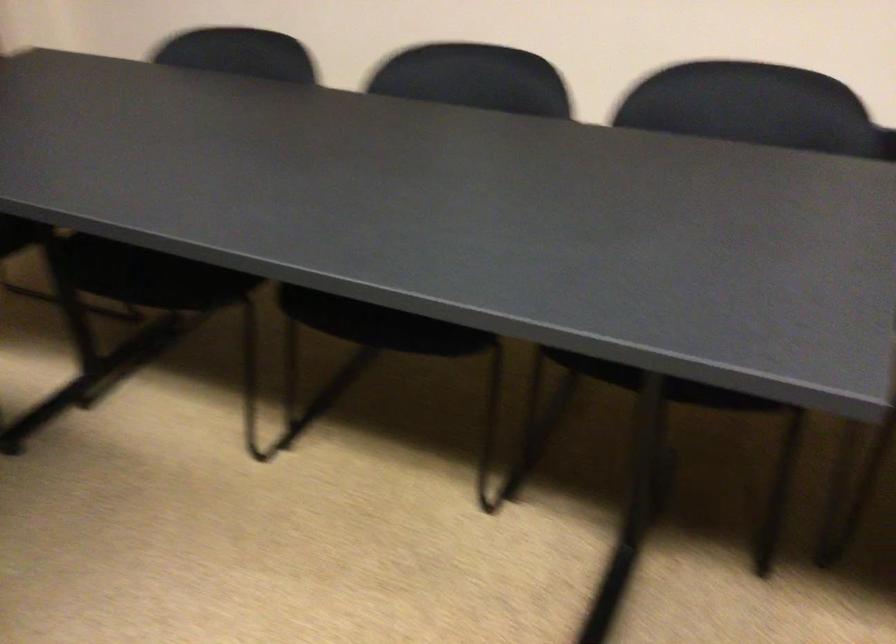
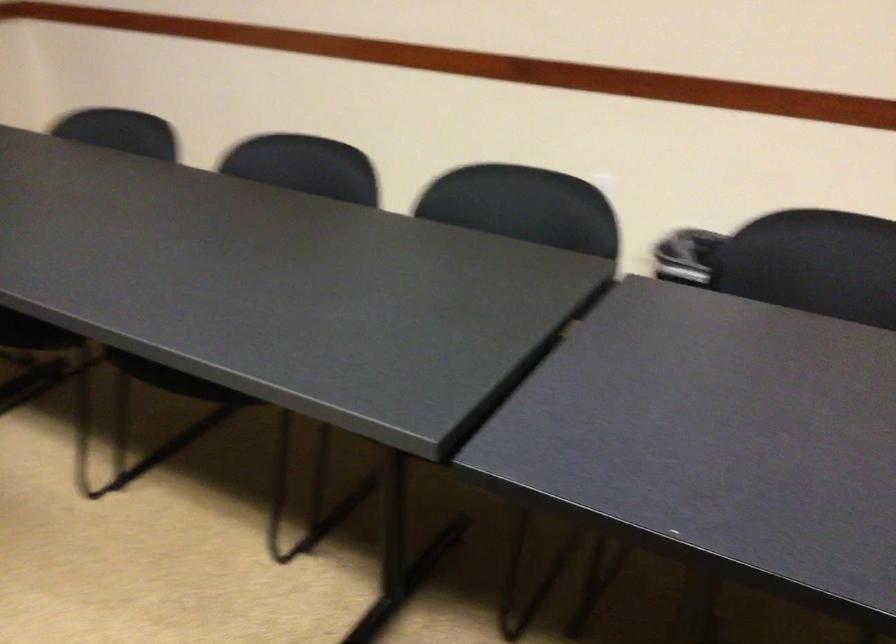
The images are taken continuously from a first-person perspective. In which direction are you moving?

The movement direction of the cameraman is right, backward.